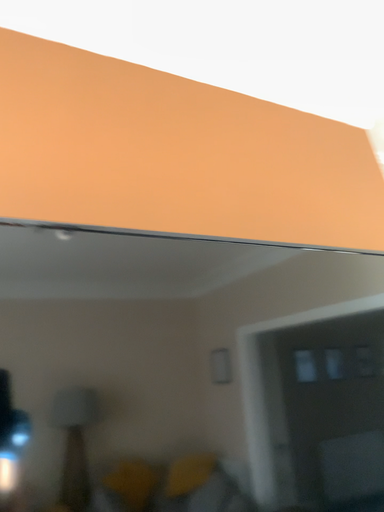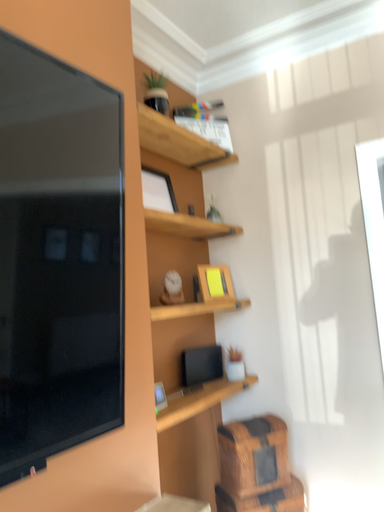
Question: Which way did the camera rotate in the video?

Choices:
 (A) rotated upward
 (B) rotated downward

Answer: (B)